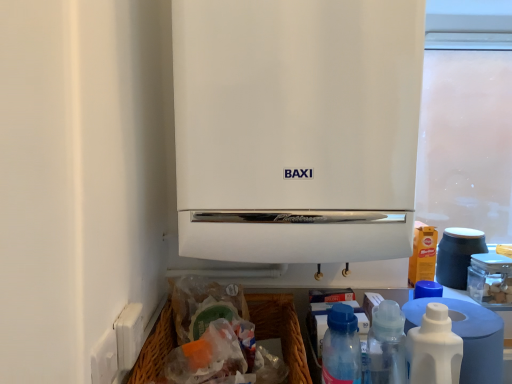
Measure the distance between point (x=440, y=381) and camera.

Point (x=440, y=381) and camera are 28.27 inches apart.

Identify the location of white matte boiler at center. (296, 128).

Measure the distance between woven brown basket at lower center and camera.

28.77 inches.

I want to click on woven brown basket at lower center, so click(280, 330).

Identify the location of blue translucent bottle at lower right, arranged as the first bottle when viewed from the left. Image resolution: width=512 pixels, height=384 pixels. (341, 347).

Which is closer to the camera, (396, 24) or (288, 335)?

The point (396, 24) is closer to the camera.

Measure the distance between white matte boiler at center and woven brown basket at lower center.

white matte boiler at center is 14.83 inches away from woven brown basket at lower center.

Does white matte boiler at center have a lesser height compared to woven brown basket at lower center?

In fact, white matte boiler at center may be taller than woven brown basket at lower center.

Does white matte boiler at center have a lesser width compared to woven brown basket at lower center?

Indeed, white matte boiler at center has a lesser width compared to woven brown basket at lower center.

In terms of width, does woven brown basket at lower center look wider or thinner when compared to white plastic bottle at lower right, which appears as the second bottle when viewed from the left?

woven brown basket at lower center is wider than white plastic bottle at lower right, which appears as the second bottle when viewed from the left.

Is woven brown basket at lower center spatially inside white plastic bottle at lower right, which appears as the second bottle when viewed from the left, or outside of it?

woven brown basket at lower center is spatially situated outside white plastic bottle at lower right, which appears as the second bottle when viewed from the left.

Is point (258, 297) farther from camera compared to point (445, 348)?

Yes, it is behind point (445, 348).

Considering the positions of objects white plastic bottle at lower right, which appears as the second bottle when viewed from the left, and blue translucent bottle at lower right, arranged as the first bottle when viewed from the left, in the image provided, who is more to the right, white plastic bottle at lower right, which appears as the second bottle when viewed from the left, or blue translucent bottle at lower right, arranged as the first bottle when viewed from the left,?

white plastic bottle at lower right, which appears as the second bottle when viewed from the left, is more to the right.

From a real-world perspective, relative to blue translucent bottle at lower right, which appears as the 2th bottle when viewed from the right, is white plastic bottle at lower right, the first bottle from the right, vertically above or below?

white plastic bottle at lower right, the first bottle from the right, is situated higher than blue translucent bottle at lower right, which appears as the 2th bottle when viewed from the right, in the real world.

Identify the location of bottle behind the blue translucent bottle at lower right, arranged as the first bottle when viewed from the left. The width and height of the screenshot is (512, 384). (434, 348).

From a real-world perspective, which is physically above, matte blue cup at right or white plastic bottle at lower right, which appears as the second bottle when viewed from the left?

matte blue cup at right is physically above.

From the image's perspective, is matte blue cup at right above or below white plastic bottle at lower right, the first bottle from the right?

Clearly, from the image's perspective, matte blue cup at right is above white plastic bottle at lower right, the first bottle from the right.

Identify the location of appliance behind the white plastic bottle at lower right, the first bottle from the right. This screenshot has height=384, width=512. (458, 255).

Considering the sizes of objects matte blue cup at right and white plastic bottle at lower right, which appears as the second bottle when viewed from the left, in the image provided, who is thinner, matte blue cup at right or white plastic bottle at lower right, which appears as the second bottle when viewed from the left,?

With smaller width is white plastic bottle at lower right, which appears as the second bottle when viewed from the left.

Considering the relative positions of matte blue cup at right and blue translucent bottle at lower right, which appears as the 2th bottle when viewed from the right, in the image provided, is matte blue cup at right to the left or to the right of blue translucent bottle at lower right, which appears as the 2th bottle when viewed from the right,?

Clearly, matte blue cup at right is on the right of blue translucent bottle at lower right, which appears as the 2th bottle when viewed from the right, in the image.

Locate an element on the screen. This screenshot has width=512, height=384. appliance on the right of blue translucent bottle at lower right, arranged as the first bottle when viewed from the left is located at coordinates (458, 255).

From the image's perspective, which one is positioned higher, matte blue cup at right or blue translucent bottle at lower right, which appears as the 2th bottle when viewed from the right?

From the image's view, matte blue cup at right is above.

Is matte blue cup at right thinner than blue translucent bottle at lower right, arranged as the first bottle when viewed from the left?

No.

Who is smaller, white plastic bottle at lower right, which appears as the second bottle when viewed from the left, or woven brown basket at lower center?

white plastic bottle at lower right, which appears as the second bottle when viewed from the left, is smaller.

From a real-world perspective, between white plastic bottle at lower right, the first bottle from the right, and woven brown basket at lower center, who is vertically higher?

white plastic bottle at lower right, the first bottle from the right, is physically above.

Which object is positioned more to the right, white plastic bottle at lower right, the first bottle from the right, or woven brown basket at lower center?

Positioned to the right is white plastic bottle at lower right, the first bottle from the right.

Considering the sizes of objects white matte boiler at center and matte blue cup at right in the image provided, who is bigger, white matte boiler at center or matte blue cup at right?

white matte boiler at center is bigger.

What's the angular difference between white matte boiler at center and matte blue cup at right's facing directions?

1.33 degrees.

Is white matte boiler at center further to camera compared to matte blue cup at right?

No, white matte boiler at center is in front of matte blue cup at right.

Is matte blue cup at right inside white matte boiler at center?

Definitely not — matte blue cup at right is not inside white matte boiler at center.

This screenshot has height=384, width=512. I want to click on basket lying in front of the white matte boiler at center, so (x=280, y=330).

Identify the location of basket located on the left of white plastic bottle at lower right, the first bottle from the right. Image resolution: width=512 pixels, height=384 pixels. (280, 330).

Which object lies nearer to the anchor point woven brown basket at lower center, matte blue cup at right or white plastic bottle at lower right, the first bottle from the right?

white plastic bottle at lower right, the first bottle from the right, is positioned closer to the anchor woven brown basket at lower center.

Looking at the image, which one is located further to white matte boiler at center, blue translucent bottle at lower right, arranged as the first bottle when viewed from the left, or woven brown basket at lower center?

Among the two, woven brown basket at lower center is located further to white matte boiler at center.

In the scene shown: When comparing their distances from woven brown basket at lower center, does white plastic bottle at lower right, which appears as the second bottle when viewed from the left, or white matte boiler at center seem further?

Among the two, white matte boiler at center is located further to woven brown basket at lower center.

Looking at the image, which one is located closer to white plastic bottle at lower right, which appears as the second bottle when viewed from the left, matte blue cup at right or blue translucent bottle at lower right, arranged as the first bottle when viewed from the left?

Among the two, blue translucent bottle at lower right, arranged as the first bottle when viewed from the left, is located nearer to white plastic bottle at lower right, which appears as the second bottle when viewed from the left.

Considering their positions, is matte blue cup at right positioned further to blue translucent bottle at lower right, arranged as the first bottle when viewed from the left, than white matte boiler at center?

matte blue cup at right lies further to blue translucent bottle at lower right, arranged as the first bottle when viewed from the left, than the other object.

Looking at the image, which one is located further to woven brown basket at lower center, blue translucent bottle at lower right, arranged as the first bottle when viewed from the left, or matte blue cup at right?

Among the two, matte blue cup at right is located further to woven brown basket at lower center.

From the image, which object appears to be farther from blue translucent bottle at lower right, which appears as the 2th bottle when viewed from the right, matte blue cup at right or white plastic bottle at lower right, the first bottle from the right?

matte blue cup at right.

Considering their positions, is white matte boiler at center positioned closer to matte blue cup at right than blue translucent bottle at lower right, which appears as the 2th bottle when viewed from the right?

blue translucent bottle at lower right, which appears as the 2th bottle when viewed from the right, is closer to matte blue cup at right.

Where is `home appliance located between blue translucent bottle at lower right, arranged as the first bottle when viewed from the left, and matte blue cup at right in the depth direction`? home appliance located between blue translucent bottle at lower right, arranged as the first bottle when viewed from the left, and matte blue cup at right in the depth direction is located at coordinates (296, 128).

The image size is (512, 384). Identify the location of bottle between woven brown basket at lower center and white plastic bottle at lower right, the first bottle from the right, from left to right. (341, 347).

Locate an element on the screen. bottle between blue translucent bottle at lower right, which appears as the 2th bottle when viewed from the right, and matte blue cup at right in the front-back direction is located at coordinates (434, 348).

In order to click on home appliance between woven brown basket at lower center and matte blue cup at right in the horizontal direction in this screenshot , I will do `click(296, 128)`.